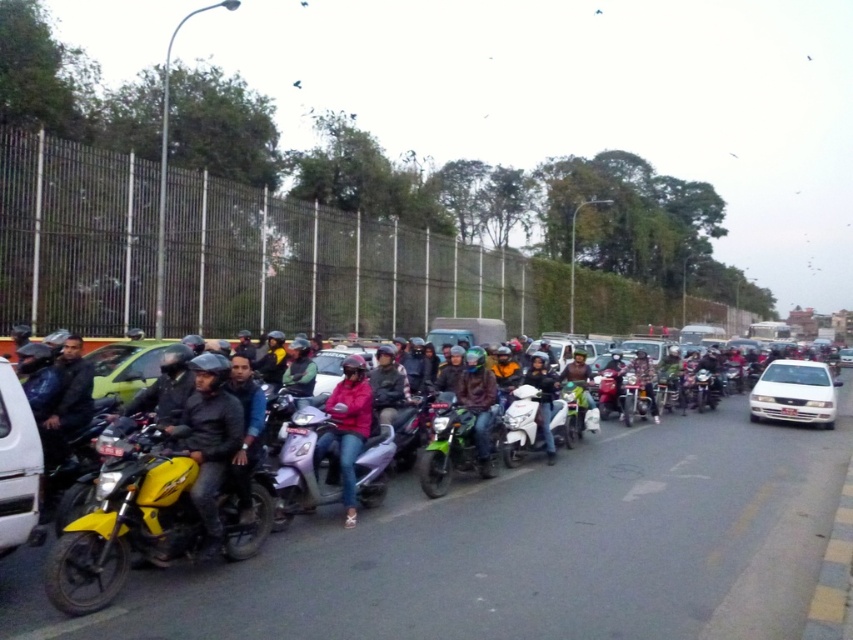
Can you confirm if metallic matte motorbikes at center is thinner than pink matte jacket at center?

No.

Between metallic matte motorbikes at center and pink matte jacket at center, which one is positioned lower?

Positioned lower is metallic matte motorbikes at center.

I want to click on metallic matte motorbikes at center, so click(x=527, y=548).

Does dark gray leather jacket at center lie in front of matte black helmet at center?

Yes, it is in front of matte black helmet at center.

Where is `dark gray leather jacket at center`? This screenshot has height=640, width=853. dark gray leather jacket at center is located at coordinates (387, 385).

Is white glossy sedan at right smaller than metallic silver scooter at center?

Incorrect, white glossy sedan at right is not smaller in size than metallic silver scooter at center.

Who is positioned more to the left, white glossy sedan at right or metallic silver scooter at center?

metallic silver scooter at center is more to the left.

Locate an element on the screen. white glossy sedan at right is located at coordinates (793, 392).

Locate an element on the screen. The width and height of the screenshot is (853, 640). white glossy sedan at right is located at coordinates (793, 392).